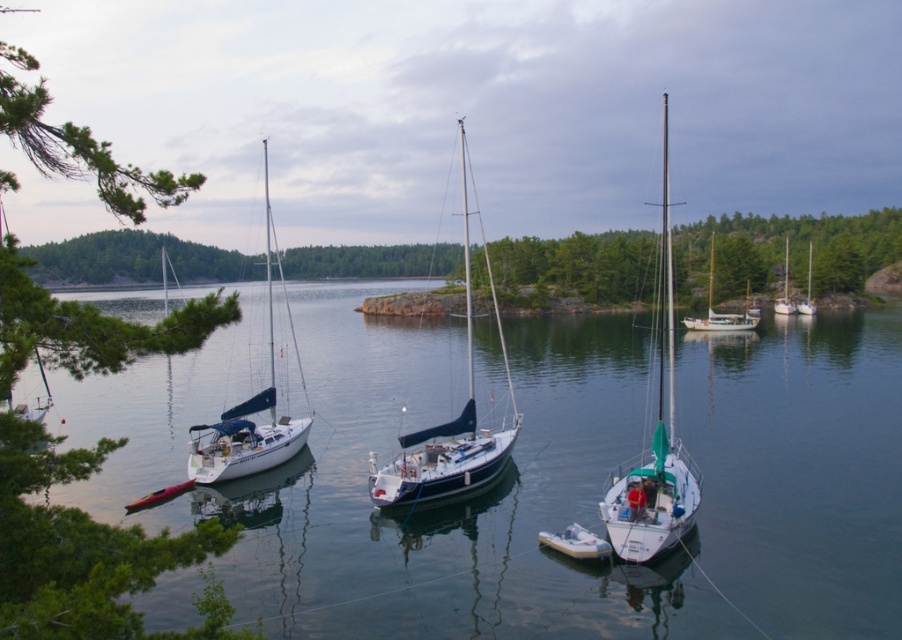
Between blue glossy sailboat at center and white glossy sailboat at right, which one appears on the right side from the viewer's perspective?

white glossy sailboat at right is more to the right.

Which is more to the left, blue glossy sailboat at center or white glossy sailboat at right?

blue glossy sailboat at center is more to the left.

Between point (484, 467) and point (807, 308), which one is positioned behind?

Point (807, 308)

Where is `blue glossy sailboat at center`? blue glossy sailboat at center is located at coordinates (451, 422).

Based on the photo, is the position of white glossy sailboat at center more distant than that of white rubber dinghy at center?

No, it is not.

Is white glossy sailboat at center taller than white rubber dinghy at center?

Yes.

Is point (661, 256) positioned after point (571, 547)?

Yes, it is.

At what (x,y) coordinates should I click in order to perform the action: click on white glossy sailboat at center. Please return your answer as a coordinate pair (x, y). The height and width of the screenshot is (640, 902). Looking at the image, I should click on (656, 440).

Does point (735, 323) come in front of point (803, 301)?

That is True.

Find the location of a particular element. The image size is (902, 640). wooden sailboat at center is located at coordinates (723, 312).

Where is `wooden sailboat at center`? Image resolution: width=902 pixels, height=640 pixels. wooden sailboat at center is located at coordinates (723, 312).